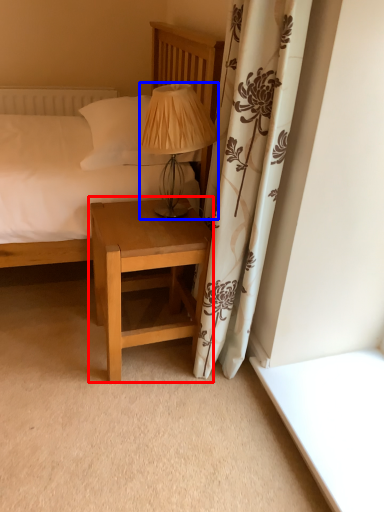
Question: Among these objects, which one is nearest to the camera, nightstand (highlighted by a red box) or table lamp (highlighted by a blue box)?

Choices:
 (A) nightstand
 (B) table lamp

Answer: (B)